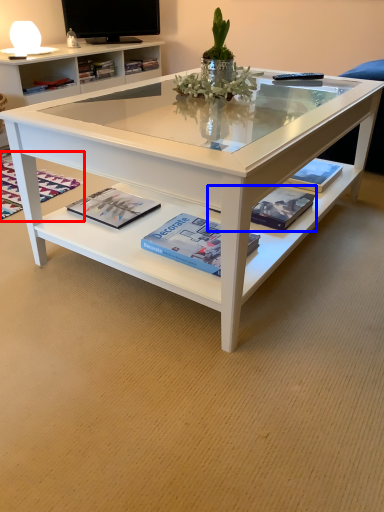
Question: Which point is further to the camera, magazine (highlighted by a red box) or magazine (highlighted by a blue box)?

Choices:
 (A) magazine
 (B) magazine

Answer: (A)